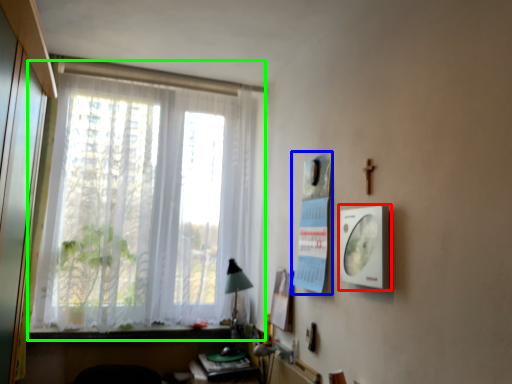
Question: Based on their relative distances, which object is farther from picture frame (highlighted by a red box)? Choose from poster page (highlighted by a blue box) and window (highlighted by a green box).

Choices:
 (A) poster page
 (B) window

Answer: (B)